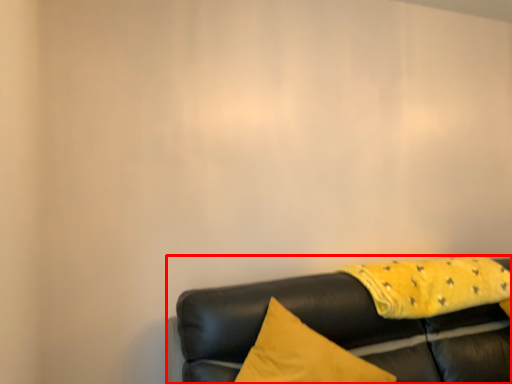
Question: Observing the image, what is the correct spatial positioning of studio couch (annotated by the red box) in reference to blanket?

Choices:
 (A) left
 (B) right

Answer: (A)